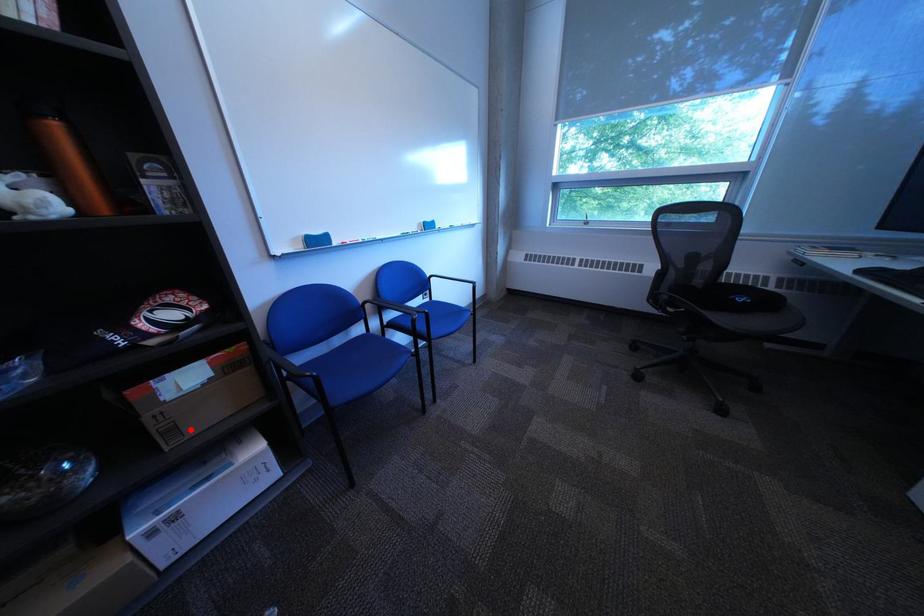
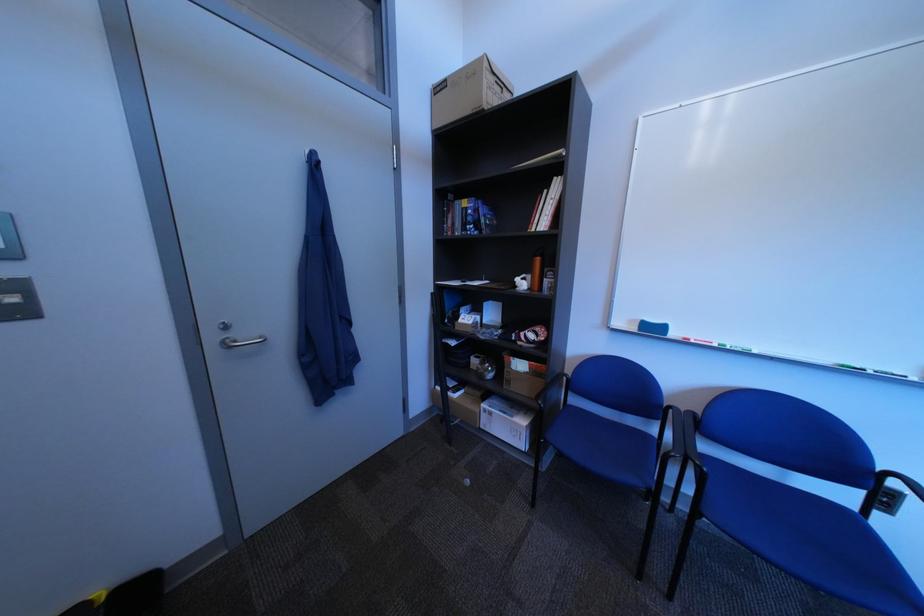
Question: I am providing you with two images of the same scene from different viewpoints. In image1, a red point is highlighted. Considering the same 3D point in image2, which of the following is correct?

Choices:
 (A) It is closer
 (B) It is farther

Answer: (B)